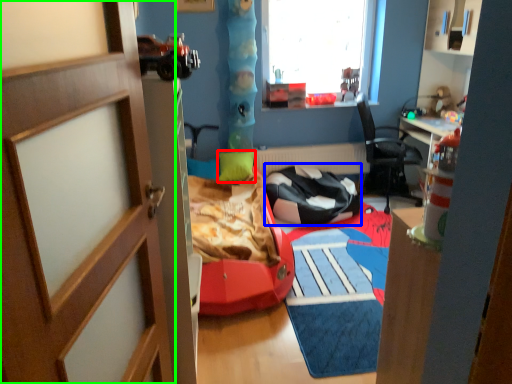
Question: Which is farther away from pillow (highlighted by a red box)? chair (highlighted by a blue box) or door (highlighted by a green box)?

Choices:
 (A) chair
 (B) door

Answer: (B)